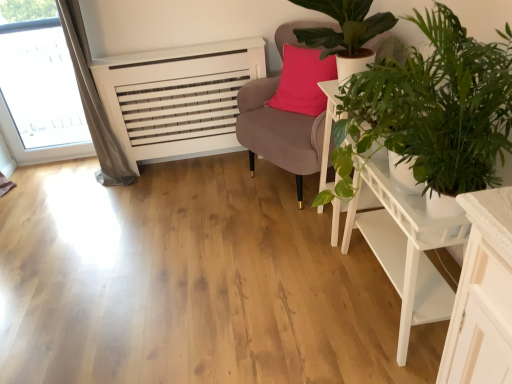
The height and width of the screenshot is (384, 512). In order to click on vacant space underneath green leafy plant at right, positioned as the 1th houseplant in front-to-back order (from a real-world perspective) in this screenshot , I will do `click(370, 354)`.